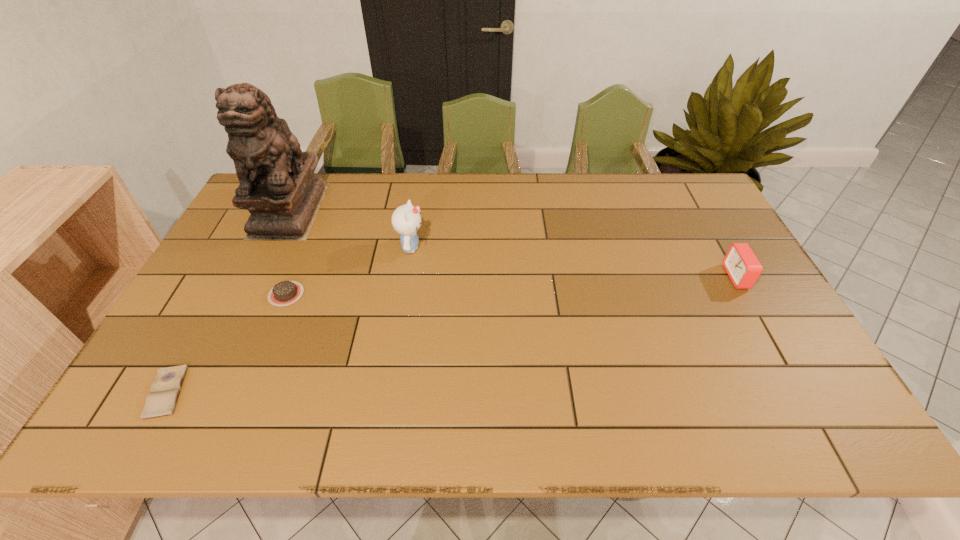
Locate an element on the screen. The image size is (960, 540). free region that satisfies the following two spatial constraints: 1. on the front-facing side of the tallest object; 2. on the left side of the chocolate cake is located at coordinates (249, 294).

This screenshot has height=540, width=960. Identify the location of free space that satisfies the following two spatial constraints: 1. on the front-facing side of the alarm clock; 2. on the front side of the second shortest object. (747, 294).

At what (x,y) coordinates should I click in order to perform the action: click on free space in the image that satisfies the following two spatial constraints: 1. on the front-facing side of the alarm clock; 2. on the front side of the nearest object. Please return your answer as a coordinate pair (x, y). The image size is (960, 540). Looking at the image, I should click on (802, 392).